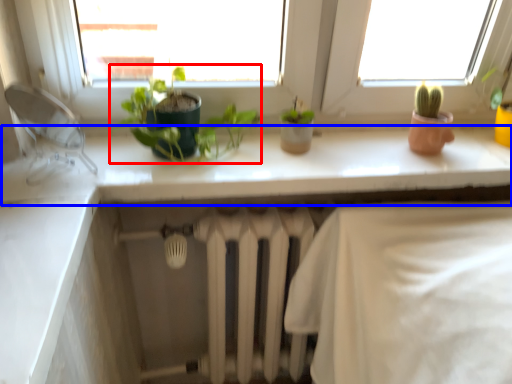
Question: Which of the following is the closest to the observer, houseplant (highlighted by a red box) or counter top (highlighted by a blue box)?

Choices:
 (A) houseplant
 (B) counter top

Answer: (A)